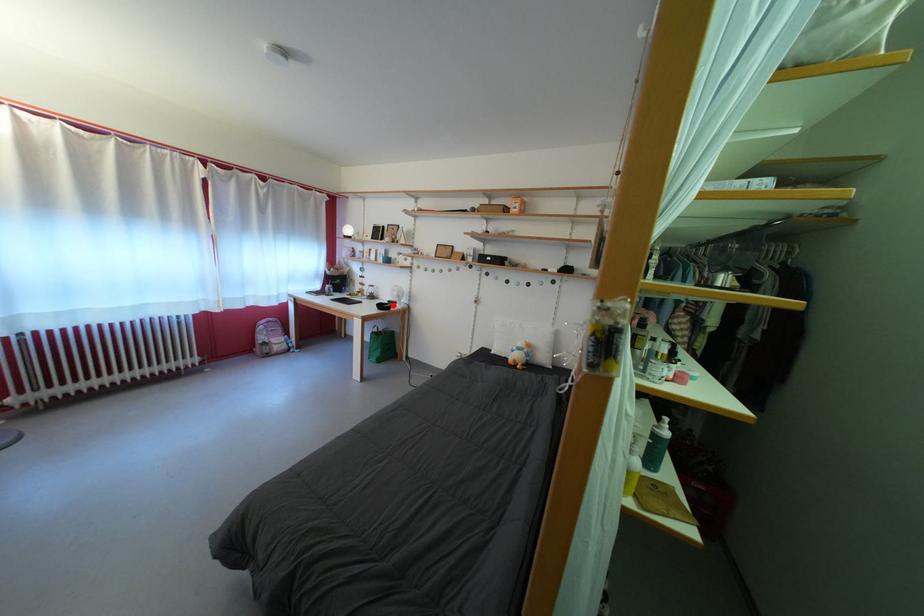
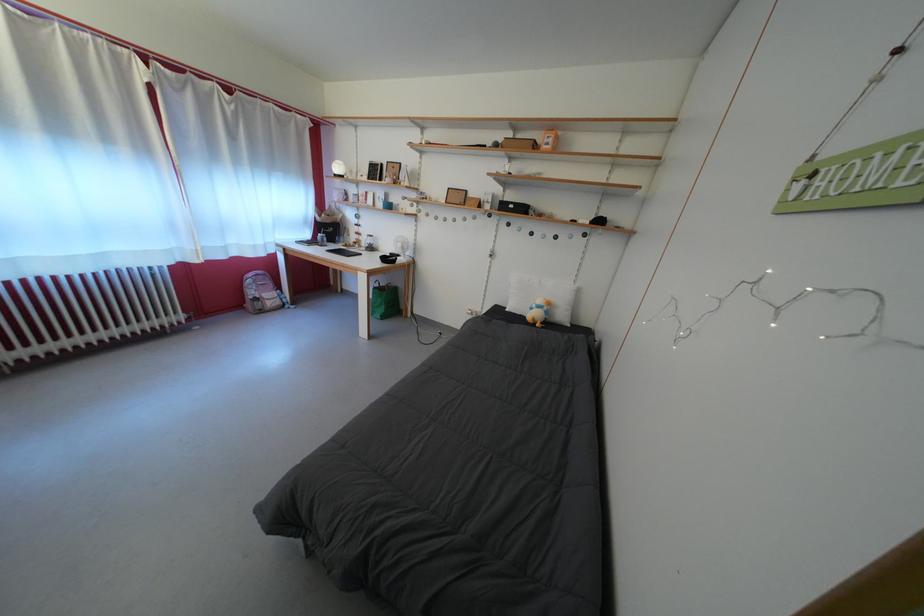
Find the pixel in the second image that matches the highlighted location in the first image.

(394, 257)